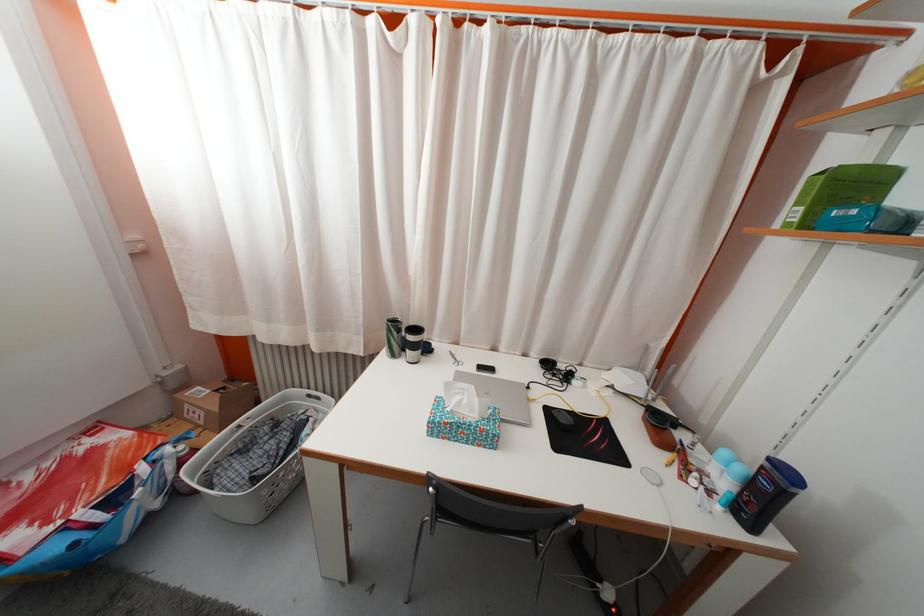
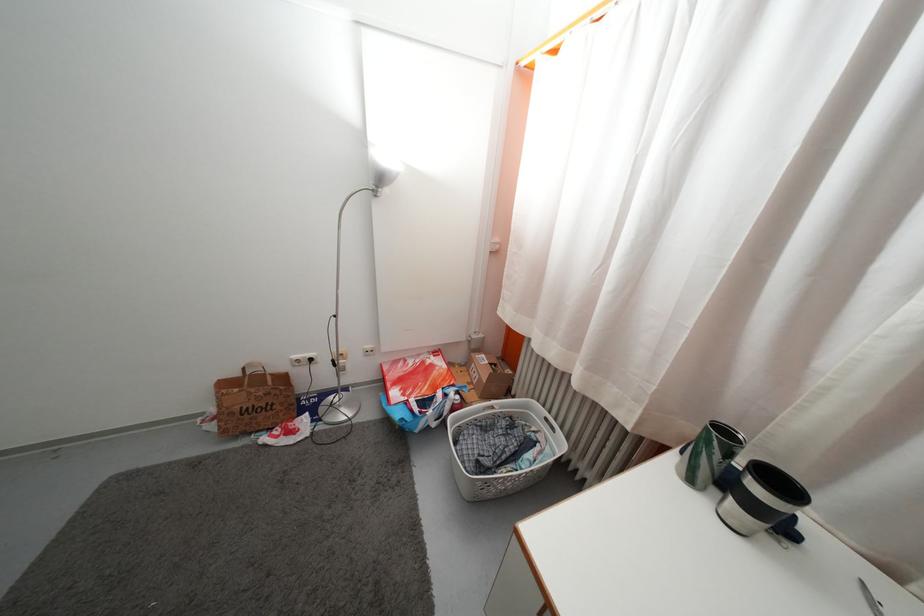
In the second image, find the point that corresponds to [203,395] in the first image.

(489, 363)